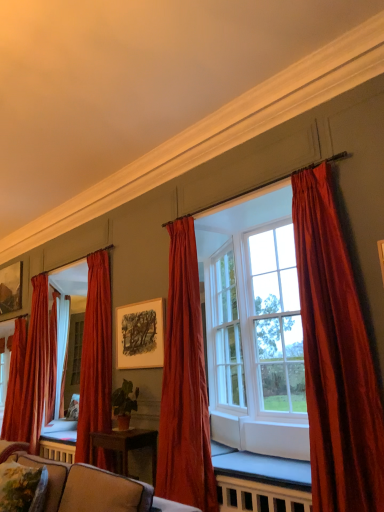
This screenshot has height=512, width=384. What do you see at coordinates (95, 489) in the screenshot? I see `velvet beige couch at lower center` at bounding box center [95, 489].

I want to click on matte white picture frame at center, which is counted as the second picture frame, starting from the left, so click(140, 335).

In the scene shown: Measure the distance between point (183, 231) and camera.

Point (183, 231) and camera are 4.36 meters apart.

The height and width of the screenshot is (512, 384). What are the coordinates of `velvet curtains at center` in the screenshot? It's located at (255, 329).

Identify the location of matte black picture frame at upper left, which appears as the 1th picture frame when viewed from the back. This screenshot has height=512, width=384. (11, 288).

Where is `green matte plant at center`? green matte plant at center is located at coordinates (124, 404).

Find the location of `pillow that appears below the velvet curtains at center (from a real-world perspective)`. pillow that appears below the velvet curtains at center (from a real-world perspective) is located at coordinates coord(22,488).

Does velvet curtains at center have a larger size compared to velvet floral pillow at lower left?

Indeed, velvet curtains at center has a larger size compared to velvet floral pillow at lower left.

Considering the points (224, 361) and (5, 504), which point is in front, point (224, 361) or point (5, 504)?

The point (5, 504) is more forward.

Looking at the image, does satin red curtain at left, the third curtain from the right, seem bigger or smaller compared to velvet red curtain at left, positioned as the fifth curtain in front-to-back order?

satin red curtain at left, the third curtain from the right, is bigger than velvet red curtain at left, positioned as the fifth curtain in front-to-back order.

Who is more distant, satin red curtain at left, which ranks as the 3th curtain in left-to-right order, or velvet red curtain at left, positioned as the 1th curtain in back-to-front order?

Positioned behind is velvet red curtain at left, positioned as the 1th curtain in back-to-front order.

Based on the photo, which object is positioned more to the right, satin red curtain at left, the 3th curtain viewed from the front, or velvet red curtain at left, which appears as the 5th curtain when viewed from the right?

Positioned to the right is satin red curtain at left, the 3th curtain viewed from the front.

Is the surface of satin red curtain at left, the third curtain from the right, in direct contact with velvet red curtain at left, which appears as the 1th curtain when viewed from the left?

No, satin red curtain at left, the third curtain from the right, is not touching velvet red curtain at left, which appears as the 1th curtain when viewed from the left.

Can you confirm if velvet red curtain at right, marked as the 5th curtain in a left-to-right arrangement, is wider than velvet red curtain at left, positioned as the fifth curtain in front-to-back order?

Correct, the width of velvet red curtain at right, marked as the 5th curtain in a left-to-right arrangement, exceeds that of velvet red curtain at left, positioned as the fifth curtain in front-to-back order.

Does velvet red curtain at right, which appears as the 1th curtain when viewed from the front, lie behind velvet red curtain at left, positioned as the 1th curtain in back-to-front order?

No, velvet red curtain at right, which appears as the 1th curtain when viewed from the front, is closer to the viewer.

Measure the distance from velvet red curtain at right, which is counted as the fifth curtain, starting from the back, to velvet red curtain at left, positioned as the 1th curtain in back-to-front order.

13.75 feet.

Which point is more distant from viewer, (302, 308) or (17, 402)?

The point (17, 402) is farther from the camera.

Considering the relative positions of velvet curtains at center and green matte plant at center in the image provided, is velvet curtains at center to the left of green matte plant at center from the viewer's perspective?

No.

Is velvet curtains at center far away from green matte plant at center?

Yes.

Does velvet curtains at center contain green matte plant at center?

Definitely not — green matte plant at center is not inside velvet curtains at center.

Who is taller, velvet curtains at center or green matte plant at center?

With more height is velvet curtains at center.

From a real-world perspective, which is physically above, velvet floral pillow at lower left or velvet curtains at center?

velvet curtains at center, from a real-world perspective.

Between velvet floral pillow at lower left and velvet curtains at center, which one appears on the left side from the viewer's perspective?

Positioned to the left is velvet floral pillow at lower left.

From their relative heights in the image, would you say velvet floral pillow at lower left is taller or shorter than velvet curtains at center?

Clearly, velvet floral pillow at lower left is shorter compared to velvet curtains at center.

Is velvet floral pillow at lower left looking in the opposite direction of velvet curtains at center?

Correct, velvet floral pillow at lower left is looking away from velvet curtains at center.

In the image, is matte black picture frame at upper left, marked as the first picture frame in a left-to-right arrangement, positioned in front of or behind velvet red curtain at left, which appears as the 1th curtain when viewed from the left?

matte black picture frame at upper left, marked as the first picture frame in a left-to-right arrangement, is behind velvet red curtain at left, which appears as the 1th curtain when viewed from the left.

Can you confirm if matte black picture frame at upper left, marked as the first picture frame in a left-to-right arrangement, is positioned to the right of velvet red curtain at left, positioned as the 1th curtain in back-to-front order?

No.

Looking at this image, how distant is matte black picture frame at upper left, which appears as the 1th picture frame when viewed from the back, from velvet red curtain at left, positioned as the 1th curtain in back-to-front order?

28.82 inches.

Is matte black picture frame at upper left, which appears as the 1th picture frame when viewed from the back, shorter than velvet red curtain at left, which appears as the 1th curtain when viewed from the left?

Yes, matte black picture frame at upper left, which appears as the 1th picture frame when viewed from the back, is shorter than velvet red curtain at left, which appears as the 1th curtain when viewed from the left.

Looking at this image, from a real-world perspective, is matte white picture frame at center, which is the first picture frame in front-to-back order, physically above velvet red curtain at right, which is counted as the fifth curtain, starting from the back?

Yes, from a real-world perspective, matte white picture frame at center, which is the first picture frame in front-to-back order, is above velvet red curtain at right, which is counted as the fifth curtain, starting from the back.

Does point (140, 326) appear closer or farther from the camera than point (325, 321)?

Point (140, 326) is farther from the camera than point (325, 321).

Which of these two, matte white picture frame at center, placed as the first picture frame when sorted from right to left, or velvet red curtain at right, which appears as the 1th curtain when viewed from the front, stands shorter?

matte white picture frame at center, placed as the first picture frame when sorted from right to left, is shorter.

From the image's perspective, is matte white picture frame at center, which is counted as the second picture frame, starting from the left, above velvet red curtain at right, which ranks as the first curtain in right-to-left order?

Actually, matte white picture frame at center, which is counted as the second picture frame, starting from the left, appears below velvet red curtain at right, which ranks as the first curtain in right-to-left order, in the image.

I want to click on window above the velvet floral pillow at lower left (from the image's perspective), so click(x=255, y=329).

You are a GUI agent. You are given a task and a screenshot of the screen. Output one action in this format:
    pyautogui.click(x=<x>, y=<y>)
    Task: Click on the 1st curtain below the satin red curtain at left, the 3th curtain in the back-to-front sequence (from a real-world perspective)
    The width and height of the screenshot is (384, 512).
    Given the screenshot: What is the action you would take?
    pyautogui.click(x=15, y=383)

Looking at the image, which one is located further to velvet red curtain at left, positioned as the fifth curtain in front-to-back order, matte black picture frame at upper left, acting as the 2th picture frame starting from the right, or velvet curtains at center?

The object further to velvet red curtain at left, positioned as the fifth curtain in front-to-back order, is velvet curtains at center.

Which object lies nearer to the anchor point matte white picture frame at center, marked as the second picture frame in a back-to-front arrangement, velvet beige couch at lower center or matte black picture frame at upper left, marked as the first picture frame in a left-to-right arrangement?

velvet beige couch at lower center is closer to matte white picture frame at center, marked as the second picture frame in a back-to-front arrangement.

When comparing their distances from satin red curtain at left, the 3th curtain in the back-to-front sequence, does velvet floral pillow at lower left or matte black picture frame at upper left, which appears as the 1th picture frame when viewed from the back, seem further?

velvet floral pillow at lower left is further to satin red curtain at left, the 3th curtain in the back-to-front sequence.

Considering their positions, is velvet beige couch at lower center positioned closer to velvet red curtain at right, which appears as the 1th curtain when viewed from the front, than velvet red curtain at center, positioned as the 2th curtain in right-to-left order?

Based on the image, velvet red curtain at center, positioned as the 2th curtain in right-to-left order, appears to be nearer to velvet red curtain at right, which appears as the 1th curtain when viewed from the front.

Considering their positions, is satin red curtain at left, the 3th curtain viewed from the front, positioned closer to velvet red curtain at left, acting as the fourth curtain starting from the front, than matte black picture frame at upper left, the 2th picture frame viewed from the front?

The object closer to velvet red curtain at left, acting as the fourth curtain starting from the front, is matte black picture frame at upper left, the 2th picture frame viewed from the front.

Based on their spatial positions, is matte white picture frame at center, placed as the first picture frame when sorted from right to left, or velvet red curtain at right, which is counted as the fifth curtain, starting from the back, closer to velvet floral pillow at lower left?

velvet red curtain at right, which is counted as the fifth curtain, starting from the back, is positioned closer to the anchor velvet floral pillow at lower left.

Estimate the real-world distances between objects in this image. Which object is closer to velvet beige couch at lower center, velvet red curtain at right, which appears as the 1th curtain when viewed from the front, or velvet red curtain at center, the second curtain when ordered from front to back?

velvet red curtain at center, the second curtain when ordered from front to back, lies closer to velvet beige couch at lower center than the other object.

From the image, which object appears to be nearer to velvet red curtain at right, which is counted as the fifth curtain, starting from the back, velvet curtains at center or velvet red curtain at center, positioned as the 2th curtain in right-to-left order?

Among the two, velvet curtains at center is located nearer to velvet red curtain at right, which is counted as the fifth curtain, starting from the back.

Find the location of a particular element. The width and height of the screenshot is (384, 512). houseplant between velvet beige couch at lower center and matte white picture frame at center, which is the first picture frame in front-to-back order, in the front-back direction is located at coordinates point(124,404).

The image size is (384, 512). In order to click on houseplant between velvet red curtain at center, positioned as the 2th curtain in right-to-left order, and velvet red curtain at left, positioned as the fifth curtain in front-to-back order, along the z-axis in this screenshot , I will do `click(124, 404)`.

At what (x,y) coordinates should I click in order to perform the action: click on picture frame between velvet red curtain at right, which appears as the 1th curtain when viewed from the front, and velvet red curtain at left, which appears as the 5th curtain when viewed from the right, along the z-axis. Please return your answer as a coordinate pair (x, y). Looking at the image, I should click on (140, 335).

Image resolution: width=384 pixels, height=512 pixels. What are the coordinates of `houseplant situated between velvet red curtain at left, acting as the fourth curtain starting from the front, and velvet red curtain at center, the second curtain when ordered from front to back, from left to right` in the screenshot? It's located at (124, 404).